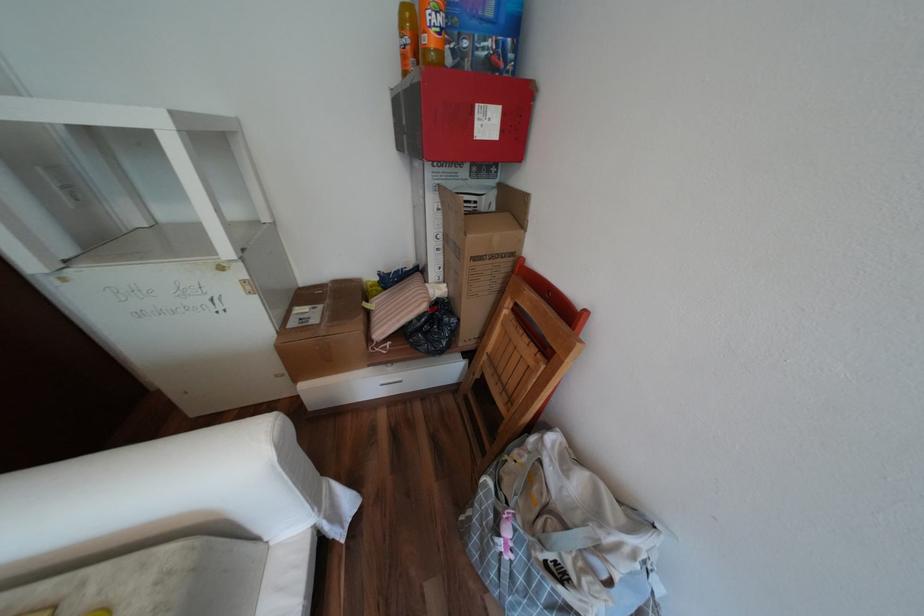
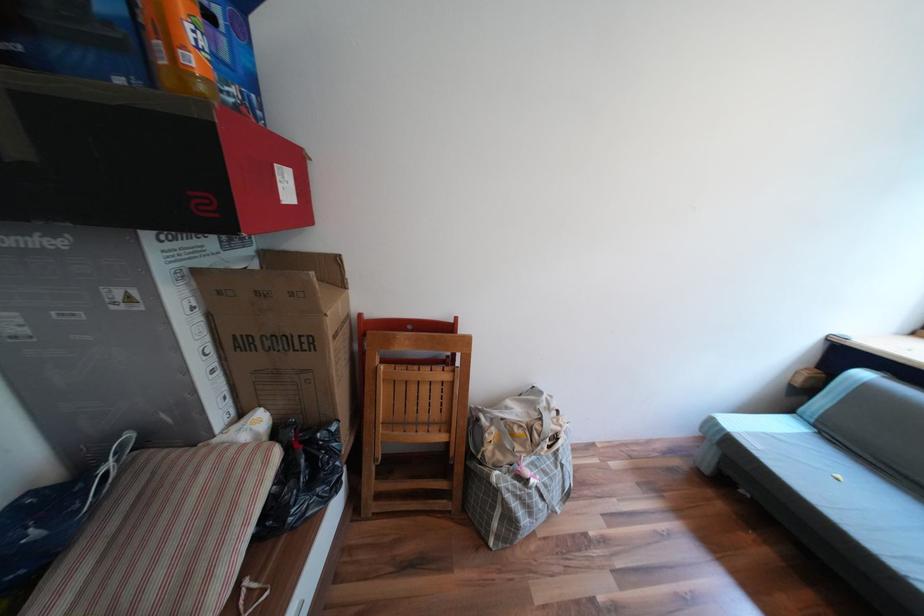
Where in the second image is the point corresponding to point 526,451 from the first image?

(495, 435)